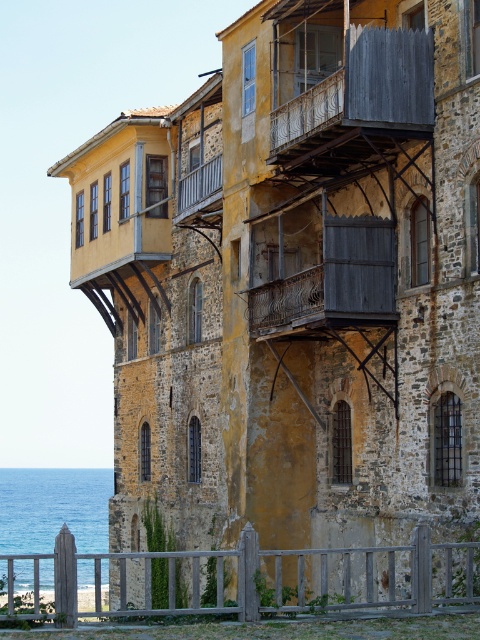
Question: Is wooden/weathered balcony at center thinner than wooden at upper center?

Choices:
 (A) no
 (B) yes

Answer: (A)

Question: Among these points, which one is nearest to the camera?

Choices:
 (A) (41, 518)
 (B) (250, 328)

Answer: (B)

Question: Can you confirm if blue water at lower left is bigger than wooden at upper center?

Choices:
 (A) yes
 (B) no

Answer: (A)

Question: Which point is farther from the camera taking this photo?

Choices:
 (A) (380, 291)
 (B) (43, 513)
 (C) (396, 35)

Answer: (B)

Question: Does wooden fence at lower center lie behind wooden/weathered balcony at center?

Choices:
 (A) no
 (B) yes

Answer: (A)

Question: Among these objects, which one is nearest to the camera?

Choices:
 (A) blue water at lower left
 (B) wooden/weathered balcony at center
 (C) wooden fence at lower center
 (D) wooden at upper center

Answer: (C)